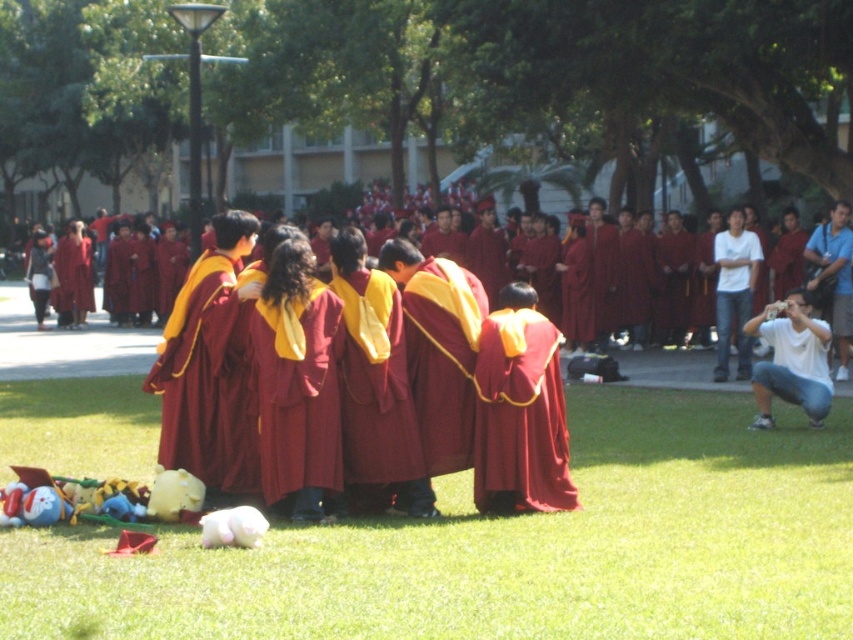
You are a photographer positioned at the edge of the grassy area. You want to capture a photo that includes both the green grass at lower center and the white cotton shirt at lower right. Based on their positions, which object should you adjust your camera angle to focus on first to ensure both are in frame?

Since the green grass at lower center is to the left of the white cotton shirt at lower right, you should first focus on the green grass at lower center to ensure the leftmost object is in frame, allowing the white cotton shirt at lower right to naturally come into view on the right side.

You are standing at the camera position and want to place a small flag at the closest point to you between point A at point [396,634] and point B at point [762,394]. Which point should you choose?

Point A at point [396,634] is closer to you than point B at point [762,394] because it is in front of it.